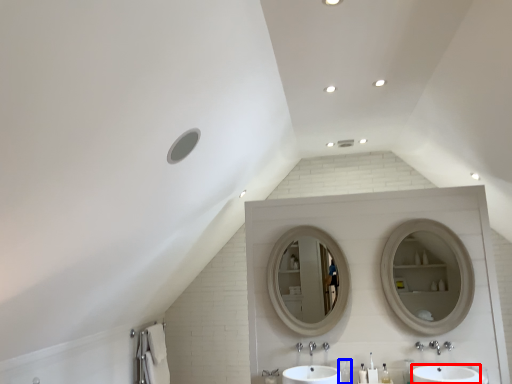
Question: Which object is further to the camera taking this photo, sink (highlighted by a red box) or toiletry (highlighted by a blue box)?

Choices:
 (A) sink
 (B) toiletry

Answer: (B)